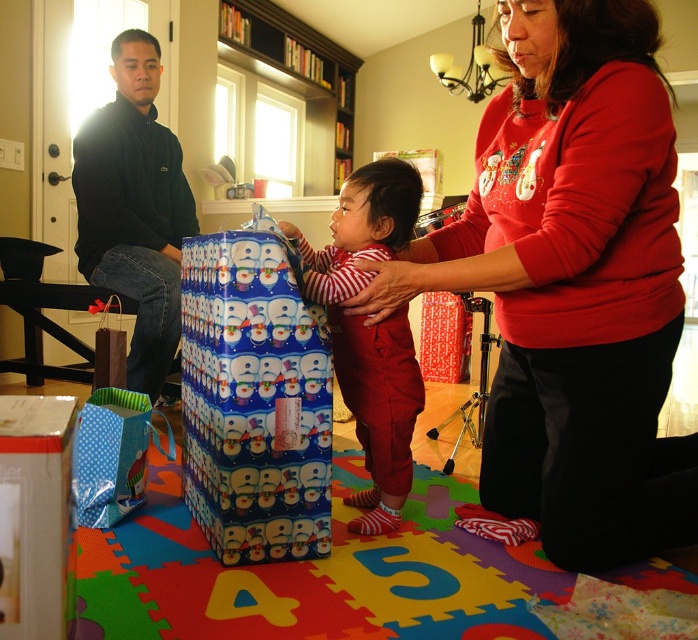
Between point (623, 4) and point (40, 435), which one is positioned behind?

Positioned behind is point (623, 4).

Who is shorter, matte red sweater at center or white cardboard box at lower left?

With less height is white cardboard box at lower left.

I want to click on matte red sweater at center, so click(572, 284).

Where is `matte red sweater at center`? matte red sweater at center is located at coordinates (572, 284).

In the scene shown: Is matte red sweater at center below dark blue fleece jacket at left?

Indeed, matte red sweater at center is positioned under dark blue fleece jacket at left.

Between matte red sweater at center and dark blue fleece jacket at left, which one appears on the right side from the viewer's perspective?

matte red sweater at center is more to the right.

Is point (475, 193) positioned behind point (141, 387)?

No, it is in front of (141, 387).

Image resolution: width=698 pixels, height=640 pixels. Find the location of `matte red sweater at center`. matte red sweater at center is located at coordinates (572, 284).

Does striped cotton onesie at center come behind white cardboard box at lower left?

Yes.

Is point (350, 385) farther from viewer compared to point (73, 588)?

Yes, it is.

Who is more distant from viewer, (396, 397) or (29, 429)?

The point (396, 397) is behind.

Find the location of a particular element. striped cotton onesie at center is located at coordinates (371, 330).